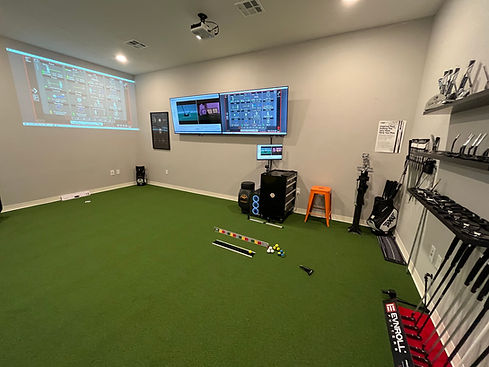
The image size is (489, 367). In order to click on projector monitor in this screenshot , I will do `click(199, 34)`.